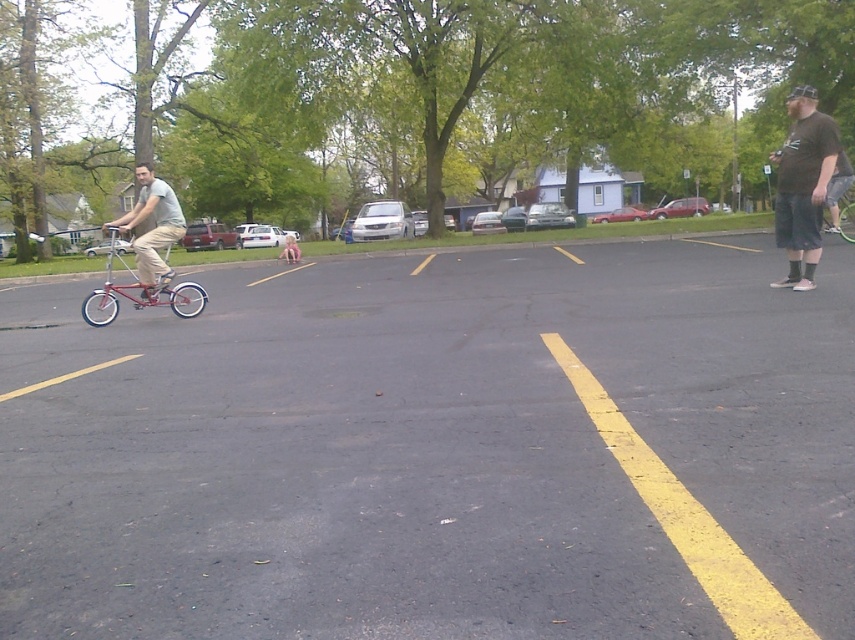
What is the 2D coordinate of the black asphalt parking lot at center?

The 2D coordinate of the black asphalt parking lot at center is at point (x=426, y=445).

You are standing in the parking lot and want to find the dark gray shorts at right. According to the coordinates provided, where should you look relative to the center of the image?

The dark gray shorts at right are located at coordinates point 0.289 on the x axis and 0.940 on the y axis, which places them to the left and above the center of the image.

You are standing at point (847, 228) and want to walk to point (140, 304). Is the path between these two points clear of any obstacles?

Yes, the path between point (140, 304) and point (847, 228) is clear because point (140, 304) is in front of point (847, 228), indicating no objects are blocking the way.